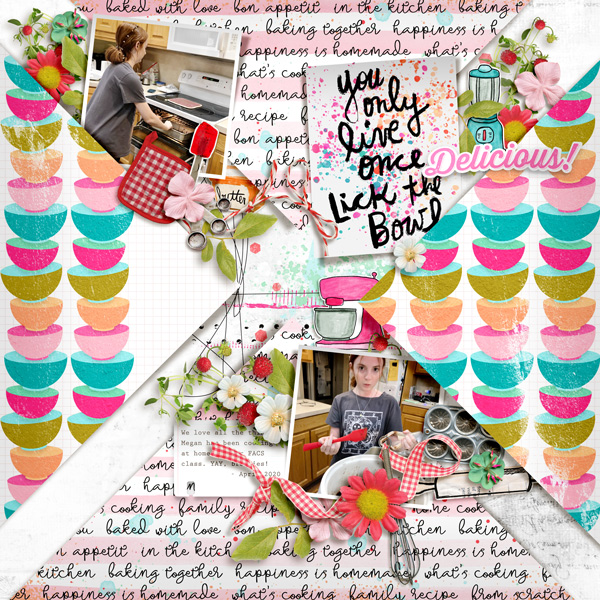
The image size is (600, 600). I want to click on grey bowls, so click(441, 419), click(465, 420), click(466, 442), click(432, 452).